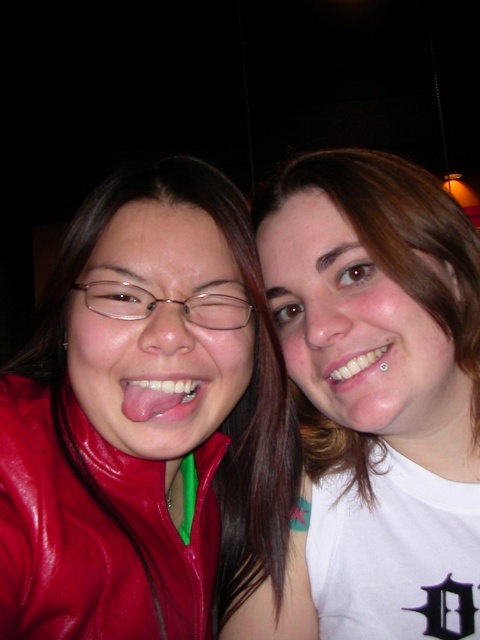
Image resolution: width=480 pixels, height=640 pixels. Identify the location of matte white tongue at center. (156, 396).

The width and height of the screenshot is (480, 640). What are the coordinates of `matte white tongue at center` in the screenshot? It's located at (156, 396).

Is shiny red jacket at center wider than matte white tongue at center?

Yes.

Describe the element at coordinates (146, 422) in the screenshot. I see `shiny red jacket at center` at that location.

Where is `shiny red jacket at center`? Image resolution: width=480 pixels, height=640 pixels. shiny red jacket at center is located at coordinates (146, 422).

Find the location of a particular element. white matte t-shirt at upper right is located at coordinates (381, 387).

Between white matte t-shirt at upper right and glossy leather jacket at lower left, which one has more height?

With more height is white matte t-shirt at upper right.

Does point (432, 234) come in front of point (41, 548)?

No, (432, 234) is behind (41, 548).

Locate an element on the screen. white matte t-shirt at upper right is located at coordinates (381, 387).